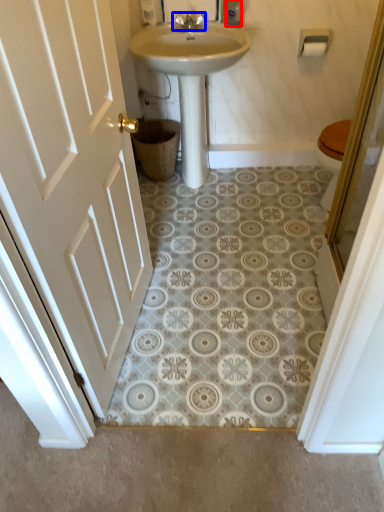
Question: Which object is closer to the camera taking this photo, toiletry (highlighted by a red box) or tap (highlighted by a blue box)?

Choices:
 (A) toiletry
 (B) tap

Answer: (A)